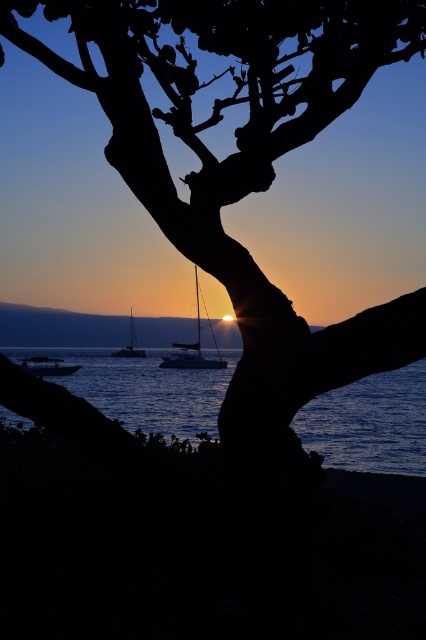
Find the location of `silhouette bark tree at center`. silhouette bark tree at center is located at coordinates (241, 161).

Which is above, silhouette bark tree at center or metallic silver boat at lower left?

silhouette bark tree at center is above.

Measure the distance between point (224, 252) and camera.

Point (224, 252) is 4.88 meters away from camera.

The width and height of the screenshot is (426, 640). I want to click on silhouette bark tree at center, so click(241, 161).

Is silhouette bark tree at center to the left of white glossy sailboat at center from the viewer's perspective?

In fact, silhouette bark tree at center is to the right of white glossy sailboat at center.

Can you confirm if silhouette bark tree at center is bigger than white glossy sailboat at center?

No.

Is point (222, 230) behind point (132, 310)?

That is False.

The height and width of the screenshot is (640, 426). Find the location of `silhouette bark tree at center`. silhouette bark tree at center is located at coordinates pos(241,161).

Describe the element at coordinates (241, 161) in the screenshot. I see `silhouette bark tree at center` at that location.

Where is `silhouette bark tree at center`? The width and height of the screenshot is (426, 640). silhouette bark tree at center is located at coordinates (241, 161).

Which is in front, point (267, 342) or point (195, 305)?

Point (267, 342) is in front.

Where is `silhouette bark tree at center`? silhouette bark tree at center is located at coordinates (241, 161).